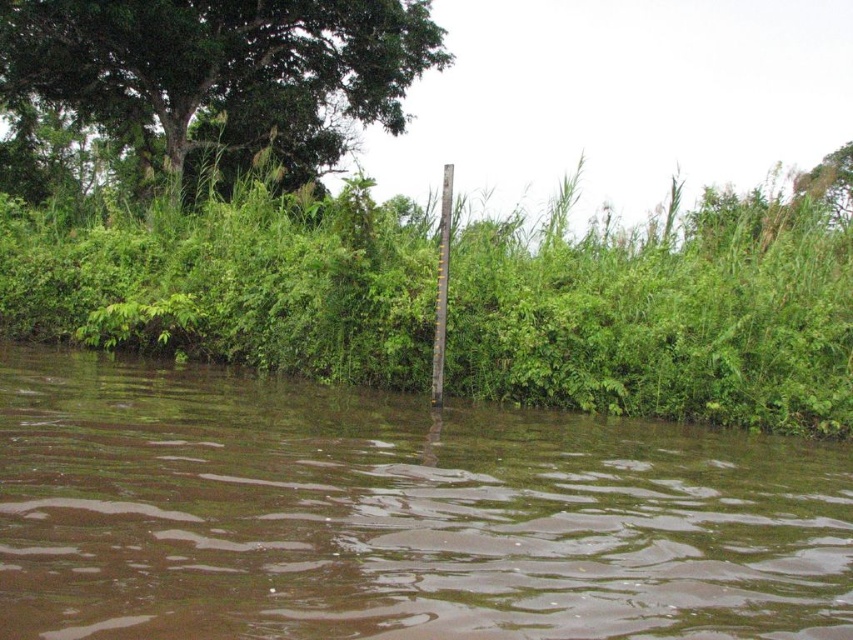
Does brown muddy water at center have a lesser height compared to green leafy tree at upper left?

Yes, brown muddy water at center is shorter than green leafy tree at upper left.

Between brown muddy water at center and green leafy tree at upper left, which one appears on the right side from the viewer's perspective?

Positioned to the right is brown muddy water at center.

What do you see at coordinates (395, 515) in the screenshot?
I see `brown muddy water at center` at bounding box center [395, 515].

At what (x,y) coordinates should I click in order to perform the action: click on brown muddy water at center. Please return your answer as a coordinate pair (x, y). The image size is (853, 640). Looking at the image, I should click on (395, 515).

Who is higher up, green leafy vegetation at center or green leafy tree at upper left?

green leafy tree at upper left

In the scene shown: Who is positioned more to the left, green leafy vegetation at center or green leafy tree at upper left?

From the viewer's perspective, green leafy tree at upper left appears more on the left side.

Is point (466, 234) positioned before point (294, 90)?

Yes, it is in front of point (294, 90).

Where is `green leafy vegetation at center`? The image size is (853, 640). green leafy vegetation at center is located at coordinates (662, 317).

Between point (289, 557) and point (631, 358), which one is positioned behind?

The point (631, 358) is behind.

Can you confirm if brown muddy water at center is positioned above green leafy vegetation at center?

Actually, brown muddy water at center is below green leafy vegetation at center.

Image resolution: width=853 pixels, height=640 pixels. I want to click on brown muddy water at center, so pyautogui.click(x=395, y=515).

The image size is (853, 640). What are the coordinates of `brown muddy water at center` in the screenshot? It's located at (395, 515).